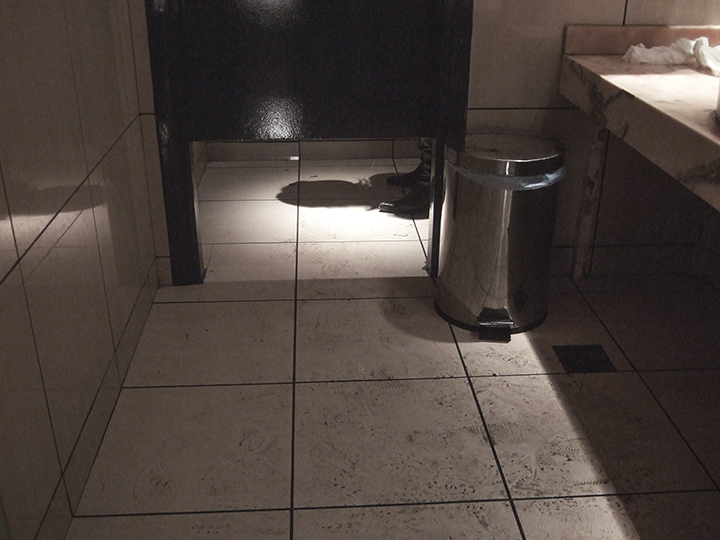
Find the location of a particular element. This screenshot has height=540, width=720. trash can lid is located at coordinates (525, 162).